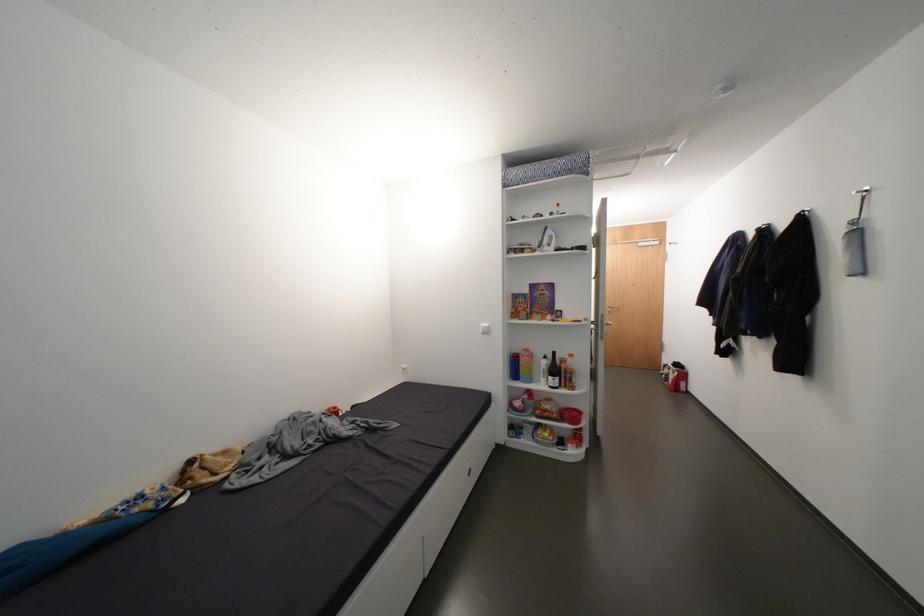
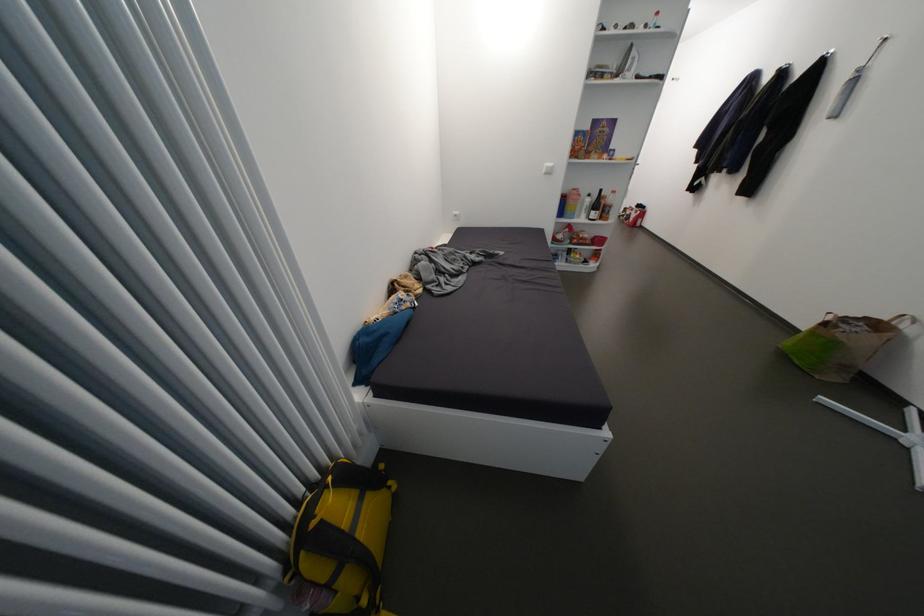
Where in the second image is the point corresponding to (x=536, y=357) from the first image?

(585, 196)